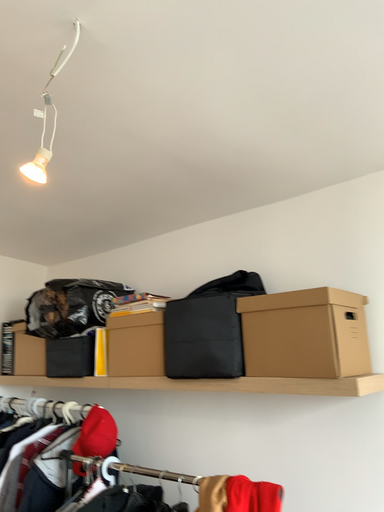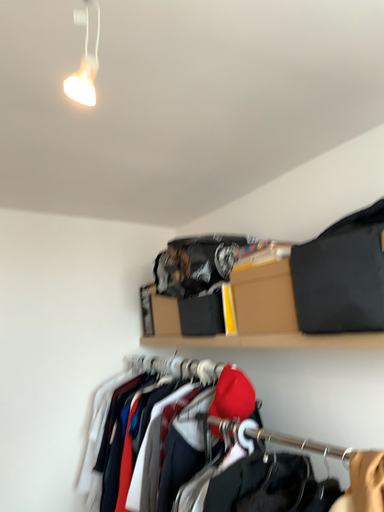
Question: How did the camera likely rotate when shooting the video?

Choices:
 (A) rotated left
 (B) rotated right

Answer: (A)